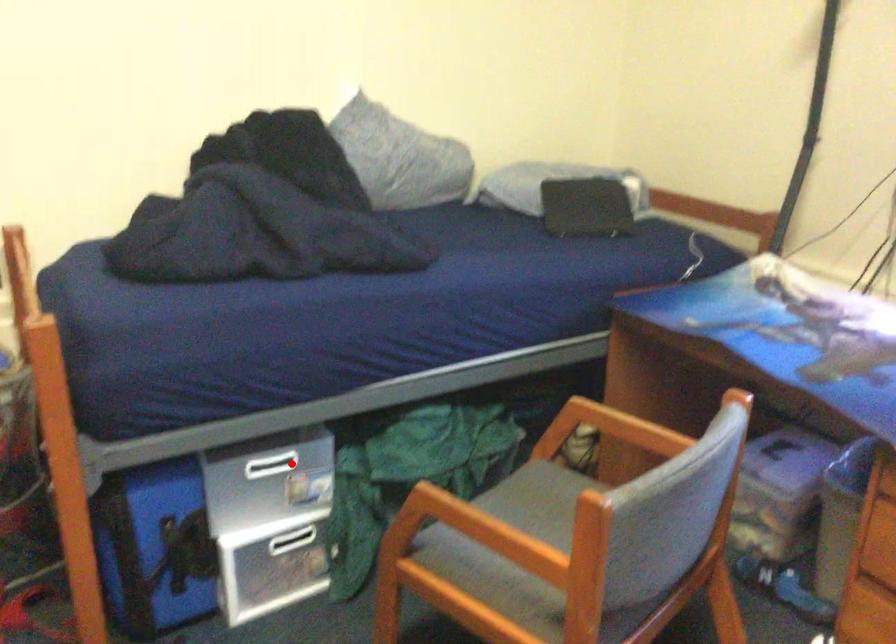
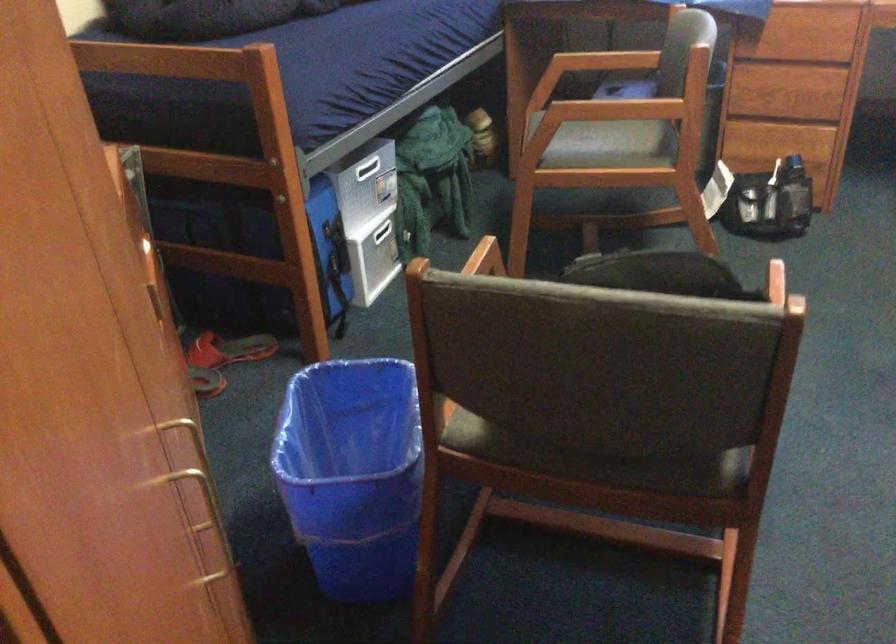
Where in the second image is the point corresponding to the highlighted location from the first image?

(366, 167)